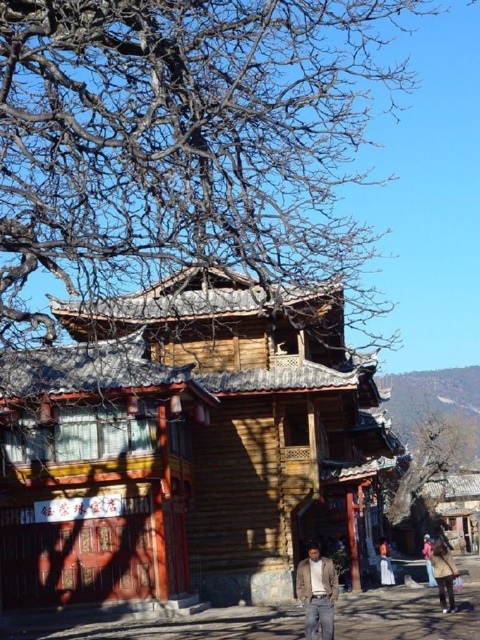
Which of these two, wooden hut at center or khaki fabric jacket at lower right, stands taller?

wooden hut at center

Who is shorter, wooden hut at center or khaki fabric jacket at lower right?

khaki fabric jacket at lower right

Is point (76, 323) farther from viewer compared to point (434, 544)?

Yes, point (76, 323) is farther from viewer.

What are the coordinates of `wooden hut at center` in the screenshot? It's located at (184, 445).

Does khaki fabric jacket at lower right have a lesser height compared to pink fabric at lower right?

Yes.

Which is in front, point (432, 552) or point (427, 573)?

Point (432, 552) is more forward.

Locate an element on the screen. The width and height of the screenshot is (480, 640). khaki fabric jacket at lower right is located at coordinates (444, 573).

Is khaki cotton pants at lower center thinner than pink fabric at lower right?

Yes, khaki cotton pants at lower center is thinner than pink fabric at lower right.

Is khaki cotton pants at lower center above pink fabric at lower right?

Correct, khaki cotton pants at lower center is located above pink fabric at lower right.

The width and height of the screenshot is (480, 640). Find the location of `khaki cotton pants at lower center`. khaki cotton pants at lower center is located at coordinates (316, 593).